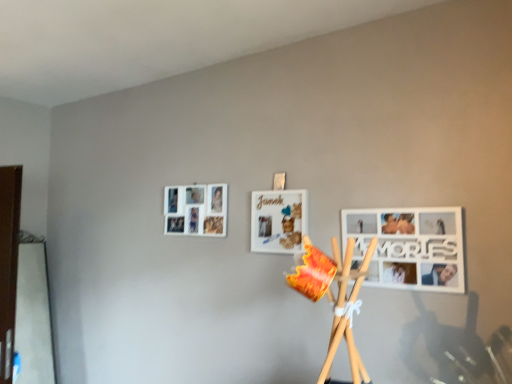
Measure the distance between point [275,200] and camera.

6.84 feet.

Describe the element at coordinates (410, 247) in the screenshot. This screenshot has height=384, width=512. I see `white matte picture frame at lower right, the third picture frame in the back-to-front sequence` at that location.

Locate an element on the screen. white matte picture frame at center, the 2th picture frame from the front is located at coordinates (278, 220).

Does white matte picture frame at upper left, which appears as the third picture frame when viewed from the front, have a smaller size compared to white matte picture frame at lower right, the 1th picture frame in the front-to-back sequence?

Incorrect, white matte picture frame at upper left, which appears as the third picture frame when viewed from the front, is not smaller in size than white matte picture frame at lower right, the 1th picture frame in the front-to-back sequence.

Could you measure the distance between white matte picture frame at upper left, which appears as the 3th picture frame when viewed from the right, and white matte picture frame at lower right, the third picture frame in the back-to-front sequence?

They are 35.26 inches apart.

Does point (190, 189) lie behind point (452, 229)?

Yes.

Is white matte picture frame at upper left, the 1th picture frame from the left, positioned with its back to white matte picture frame at lower right, the first picture frame in the right-to-left sequence?

No, white matte picture frame at upper left, the 1th picture frame from the left, is not facing the opposite direction of white matte picture frame at lower right, the first picture frame in the right-to-left sequence.

How far apart are white matte picture frame at center, acting as the second picture frame starting from the left, and white matte picture frame at lower right, the 1th picture frame in the front-to-back sequence?

white matte picture frame at center, acting as the second picture frame starting from the left, and white matte picture frame at lower right, the 1th picture frame in the front-to-back sequence, are 41.15 centimeters apart from each other.

In the scene shown: Do you think white matte picture frame at center, acting as the second picture frame starting from the left, is within white matte picture frame at lower right, the third picture frame in the back-to-front sequence, or outside of it?

white matte picture frame at center, acting as the second picture frame starting from the left, is not enclosed by white matte picture frame at lower right, the third picture frame in the back-to-front sequence.

Is white matte picture frame at center, the 2th picture frame when ordered from back to front, looking in the opposite direction of white matte picture frame at lower right, the first picture frame in the right-to-left sequence?

white matte picture frame at center, the 2th picture frame when ordered from back to front, is not turned away from white matte picture frame at lower right, the first picture frame in the right-to-left sequence.

Is white matte picture frame at center, positioned as the second picture frame in right-to-left order, at the left side of white matte picture frame at lower right, arranged as the 3th picture frame when viewed from the left?

Correct, you'll find white matte picture frame at center, positioned as the second picture frame in right-to-left order, to the left of white matte picture frame at lower right, arranged as the 3th picture frame when viewed from the left.

Looking at their sizes, would you say white matte picture frame at lower right, arranged as the 3th picture frame when viewed from the left, is wider or thinner than white matte picture frame at upper left, the 1th picture frame from the left?

Clearly, white matte picture frame at lower right, arranged as the 3th picture frame when viewed from the left, has less width compared to white matte picture frame at upper left, the 1th picture frame from the left.

From a real-world perspective, is white matte picture frame at lower right, the 1th picture frame in the front-to-back sequence, above or below white matte picture frame at upper left, positioned as the 1th picture frame in back-to-front order?

white matte picture frame at lower right, the 1th picture frame in the front-to-back sequence, is below white matte picture frame at upper left, positioned as the 1th picture frame in back-to-front order.

Consider the image. From the image's perspective, is white matte picture frame at lower right, the first picture frame in the right-to-left sequence, over white matte picture frame at upper left, which appears as the third picture frame when viewed from the front?

No, from the image's perspective, white matte picture frame at lower right, the first picture frame in the right-to-left sequence, is not on top of white matte picture frame at upper left, which appears as the third picture frame when viewed from the front.

Which is in front, white matte picture frame at lower right, the third picture frame in the back-to-front sequence, or white matte picture frame at upper left, positioned as the 1th picture frame in back-to-front order?

Positioned in front is white matte picture frame at lower right, the third picture frame in the back-to-front sequence.

Is white matte picture frame at lower right, arranged as the 3th picture frame when viewed from the left, outside of white matte picture frame at center, positioned as the second picture frame in right-to-left order?

Absolutely, white matte picture frame at lower right, arranged as the 3th picture frame when viewed from the left, is external to white matte picture frame at center, positioned as the second picture frame in right-to-left order.

Is white matte picture frame at lower right, the third picture frame in the back-to-front sequence, oriented away from white matte picture frame at center, the 2th picture frame from the front?

No, white matte picture frame at center, the 2th picture frame from the front, is not at the back of white matte picture frame at lower right, the third picture frame in the back-to-front sequence.

Between white matte picture frame at lower right, the first picture frame in the right-to-left sequence, and white matte picture frame at center, the 2th picture frame from the front, which one has more height?

white matte picture frame at lower right, the first picture frame in the right-to-left sequence, is taller.

Does white matte picture frame at center, the 2th picture frame from the front, appear on the left side of white matte picture frame at upper left, the 1th picture frame from the left?

No, white matte picture frame at center, the 2th picture frame from the front, is not to the left of white matte picture frame at upper left, the 1th picture frame from the left.

Does white matte picture frame at center, acting as the second picture frame starting from the left, touch white matte picture frame at upper left, which appears as the 3th picture frame when viewed from the right?

No, white matte picture frame at center, acting as the second picture frame starting from the left, is not in contact with white matte picture frame at upper left, which appears as the 3th picture frame when viewed from the right.

From a real-world perspective, is white matte picture frame at center, the 2th picture frame from the front, physically below white matte picture frame at upper left, positioned as the 1th picture frame in back-to-front order?

Indeed, from a real-world perspective, white matte picture frame at center, the 2th picture frame from the front, is positioned beneath white matte picture frame at upper left, positioned as the 1th picture frame in back-to-front order.

Between white matte picture frame at center, acting as the second picture frame starting from the left, and white matte picture frame at upper left, the 1th picture frame from the left, which one is positioned behind?

white matte picture frame at upper left, the 1th picture frame from the left, is further from the camera.

Considering the relative sizes of white matte picture frame at upper left, positioned as the 1th picture frame in back-to-front order, and white matte picture frame at center, positioned as the second picture frame in right-to-left order, in the image provided, is white matte picture frame at upper left, positioned as the 1th picture frame in back-to-front order, smaller than white matte picture frame at center, positioned as the second picture frame in right-to-left order,?

No.

Is white matte picture frame at upper left, which appears as the 3th picture frame when viewed from the right, not close to white matte picture frame at center, the 2th picture frame when ordered from back to front?

No, white matte picture frame at upper left, which appears as the 3th picture frame when viewed from the right, is not far away from white matte picture frame at center, the 2th picture frame when ordered from back to front.

From the image's perspective, which is above, white matte picture frame at upper left, positioned as the 1th picture frame in back-to-front order, or white matte picture frame at center, the 2th picture frame from the front?

white matte picture frame at upper left, positioned as the 1th picture frame in back-to-front order, from the image's perspective.

Identify the location of the 2nd picture frame positioned above the white matte picture frame at lower right, the 1th picture frame in the front-to-back sequence (from the image's perspective). (196, 210).

Starting from the white matte picture frame at lower right, the 1th picture frame in the front-to-back sequence, which picture frame is the 1st one behind? Please provide its 2D coordinates.

[(278, 220)]

Consider the image. Which object lies further to the anchor point white matte picture frame at lower right, arranged as the 3th picture frame when viewed from the left, white matte picture frame at center, acting as the second picture frame starting from the left, or white matte picture frame at upper left, which appears as the third picture frame when viewed from the front?

Among the two, white matte picture frame at upper left, which appears as the third picture frame when viewed from the front, is located further to white matte picture frame at lower right, arranged as the 3th picture frame when viewed from the left.

Considering their positions, is white matte picture frame at lower right, the third picture frame in the back-to-front sequence, positioned further to white matte picture frame at center, the 2th picture frame from the front, than white matte picture frame at upper left, which appears as the 3th picture frame when viewed from the right?

Based on the image, white matte picture frame at lower right, the third picture frame in the back-to-front sequence, appears to be further to white matte picture frame at center, the 2th picture frame from the front.

Consider the image. From the image, which object appears to be farther from white matte picture frame at upper left, the 1th picture frame from the left, white matte picture frame at center, positioned as the second picture frame in right-to-left order, or white matte picture frame at lower right, arranged as the 3th picture frame when viewed from the left?

Based on the image, white matte picture frame at lower right, arranged as the 3th picture frame when viewed from the left, appears to be further to white matte picture frame at upper left, the 1th picture frame from the left.

Considering their positions, is white matte picture frame at upper left, which appears as the 3th picture frame when viewed from the right, positioned closer to white matte picture frame at center, acting as the second picture frame starting from the left, than white matte picture frame at lower right, arranged as the 3th picture frame when viewed from the left?

white matte picture frame at upper left, which appears as the 3th picture frame when viewed from the right, is closer to white matte picture frame at center, acting as the second picture frame starting from the left.

Estimate the real-world distances between objects in this image. Which object is further from white matte picture frame at lower right, the third picture frame in the back-to-front sequence, white matte picture frame at upper left, positioned as the 1th picture frame in back-to-front order, or white matte picture frame at center, acting as the second picture frame starting from the left?

white matte picture frame at upper left, positioned as the 1th picture frame in back-to-front order, lies further to white matte picture frame at lower right, the third picture frame in the back-to-front sequence, than the other object.

Estimate the real-world distances between objects in this image. Which object is closer to white matte picture frame at upper left, which appears as the third picture frame when viewed from the front, white matte picture frame at lower right, the 1th picture frame in the front-to-back sequence, or white matte picture frame at center, the 2th picture frame from the front?

The object closer to white matte picture frame at upper left, which appears as the third picture frame when viewed from the front, is white matte picture frame at center, the 2th picture frame from the front.

Identify the location of picture frame located between white matte picture frame at upper left, the 1th picture frame from the left, and white matte picture frame at lower right, arranged as the 3th picture frame when viewed from the left, in the left-right direction. The image size is (512, 384). point(278,220).